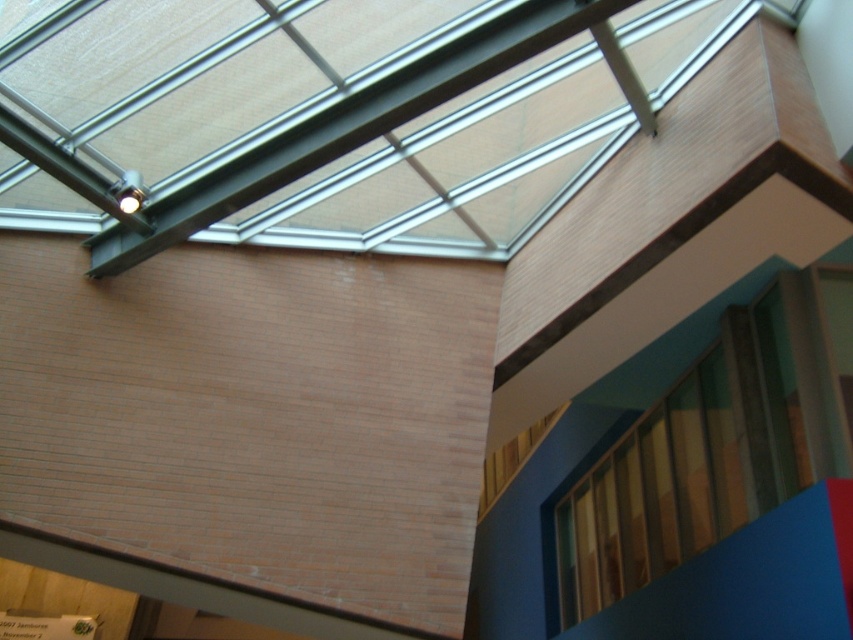
You are an architect designing a new building and want to ensure that the wooden textured window at upper right and the wooden at upper right are positioned correctly. Based on the scene, which object is closer to the observer?

The wooden textured window at upper right is closer to the observer than the wooden at upper right.

You are an architect designing a new building and want to ensure proper ventilation. You have two wooden structures at the upper right corner of the wall. One is labeled as the wooden textured window at upper right and the other is simply wooden at upper right. Which of these two structures is shorter in height?

The wooden textured window at upper right is shorter in height than the wooden at upper right because it is not as tall as the latter.

You are an architect designing a new building and want to ensure that the wooden textured window at upper right can be seen from the wooden at upper right. Based on their positions, is this possible?

The wooden textured window at upper right is positioned over the wooden at upper right, so yes, the wooden textured window at upper right can be seen from the wooden at upper right as it is above it.